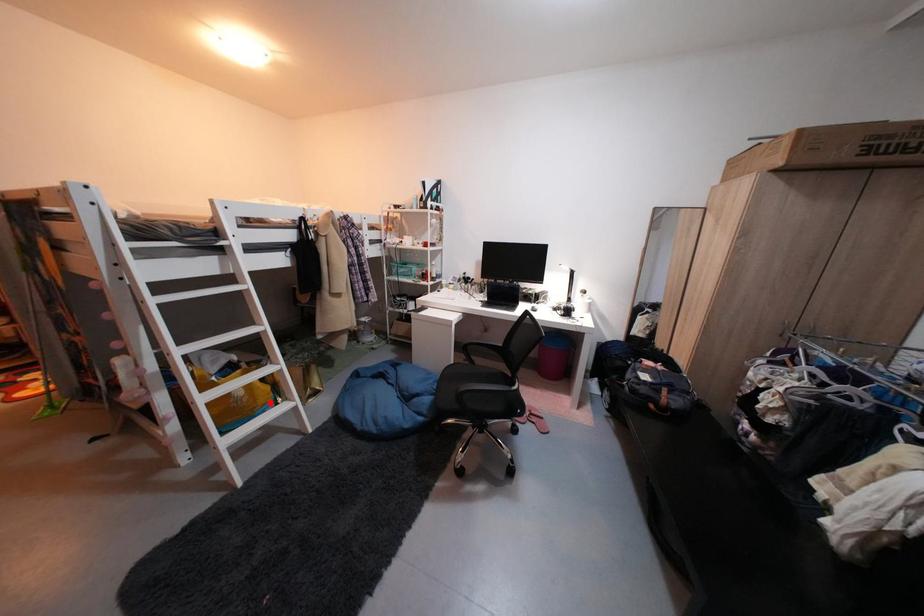
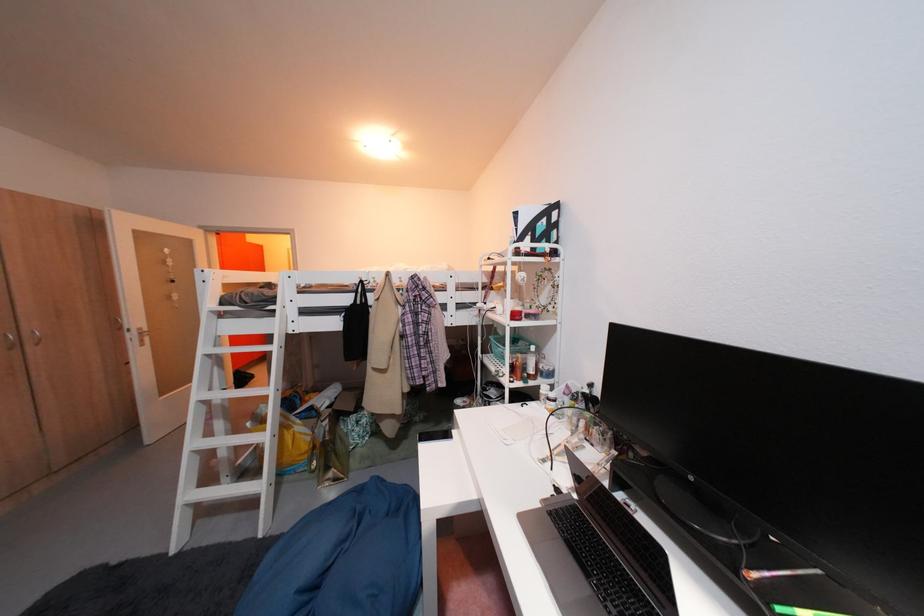
Question: I am providing you with two images of the same scene from different viewpoints. In image1, a red point is highlighted. Considering the same 3D point in image2, which of the following is correct?

Choices:
 (A) It is closer
 (B) It is farther

Answer: (B)